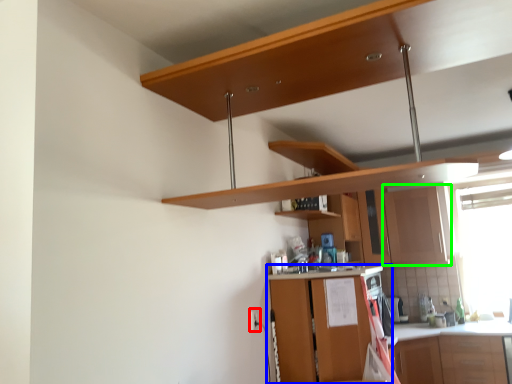
Question: Which object is positioned closest to electric outlet (highlighted by a red box)? Select from cabinetry (highlighted by a blue box) and cabinetry (highlighted by a green box).

Choices:
 (A) cabinetry
 (B) cabinetry

Answer: (A)